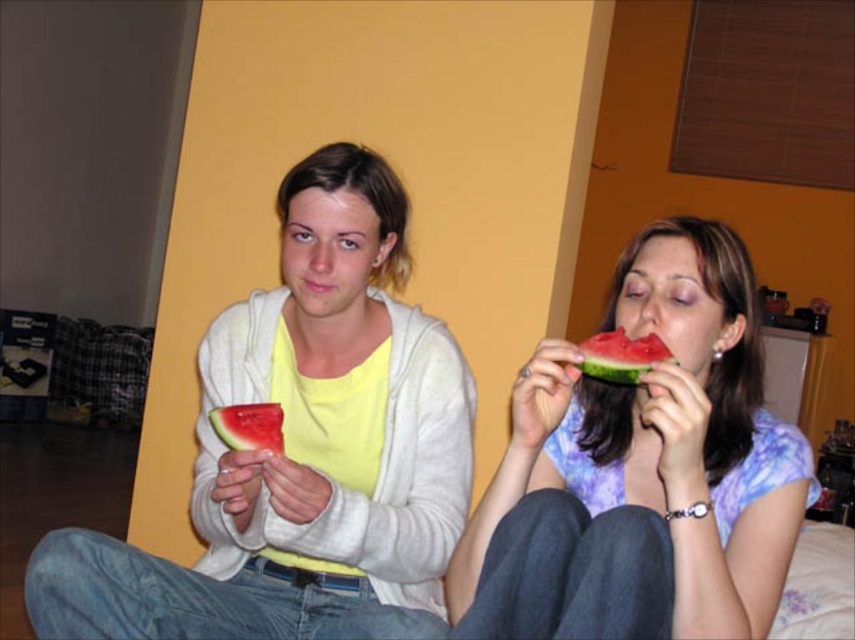
Is matte yellow shirt at center positioned before juicy red watermelon at center?

No, matte yellow shirt at center is behind juicy red watermelon at center.

You are a GUI agent. You are given a task and a screenshot of the screen. Output one action in this format:
    pyautogui.click(x=<x>, y=<y>)
    Task: Click on the matte yellow shirt at center
    Image resolution: width=855 pixels, height=640 pixels.
    Given the screenshot: What is the action you would take?
    point(302,449)

Who is shorter, watermelon at center or juicy red watermelon at center?

With less height is juicy red watermelon at center.

Which is above, watermelon at center or juicy red watermelon at center?

watermelon at center

Who is more distant from viewer, (x=618, y=342) or (x=236, y=424)?

The point (x=236, y=424) is more distant.

Locate an element on the screen. watermelon at center is located at coordinates (620, 356).

Who is shorter, matte yellow shirt at center or matte purple shirt at right?

Standing shorter between the two is matte purple shirt at right.

Can you confirm if matte yellow shirt at center is thinner than matte purple shirt at right?

No.

The height and width of the screenshot is (640, 855). Describe the element at coordinates (302, 449) in the screenshot. I see `matte yellow shirt at center` at that location.

Locate an element on the screen. This screenshot has height=640, width=855. matte yellow shirt at center is located at coordinates (302, 449).